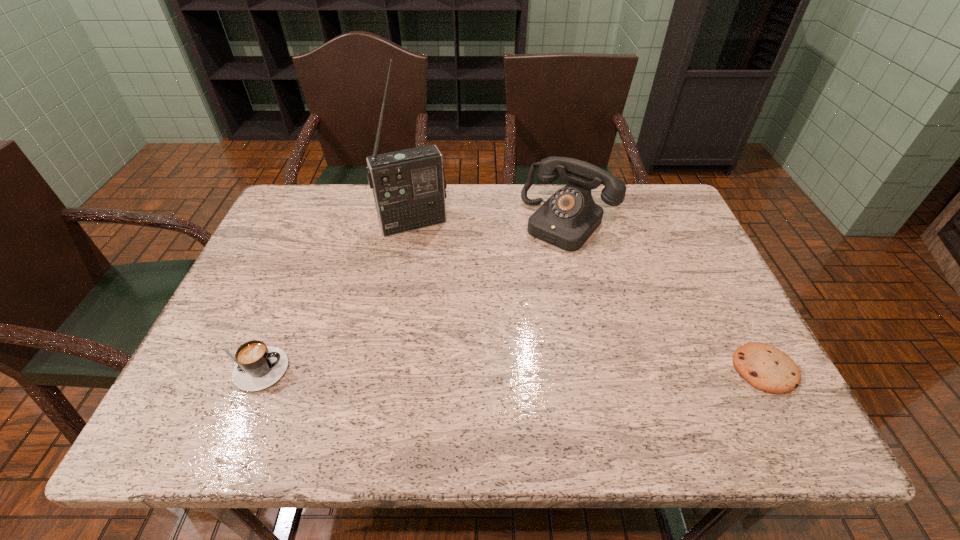
Image resolution: width=960 pixels, height=540 pixels. I want to click on vacant space in between the radio receiver and the second tallest object, so click(x=492, y=222).

Where is `free space between the cappuccino and the shortest object`? The width and height of the screenshot is (960, 540). free space between the cappuccino and the shortest object is located at coordinates (508, 369).

Find the location of a particular element. The image size is (960, 540). free space between the third object from right to left and the second tallest object is located at coordinates (492, 222).

I want to click on free space between the second shortest object and the tallest object, so click(x=332, y=296).

Where is `unoccupied area between the second object from right to left and the cappuccino`? unoccupied area between the second object from right to left and the cappuccino is located at coordinates (410, 296).

Identify the location of vacant space that's between the radio receiver and the second object from right to left. The height and width of the screenshot is (540, 960). (492, 222).

The width and height of the screenshot is (960, 540). Identify the location of free space that is in between the third object from left to right and the shortest object. (666, 295).

What are the coordinates of `vacant space in between the third tallest object and the radio receiver` in the screenshot? It's located at (332, 296).

Locate an element on the screen. This screenshot has width=960, height=540. unoccupied position between the third object from left to right and the radio receiver is located at coordinates (492, 222).

I want to click on object that is the second closest one to the second shortest object, so click(x=568, y=218).